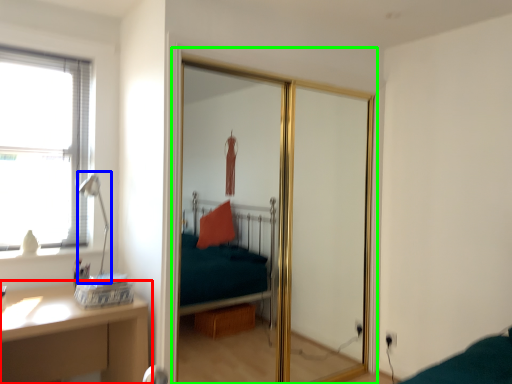
Question: Which is farther away from table (highlighted by a red box)? table lamp (highlighted by a blue box) or screen door (highlighted by a green box)?

Choices:
 (A) table lamp
 (B) screen door

Answer: (B)